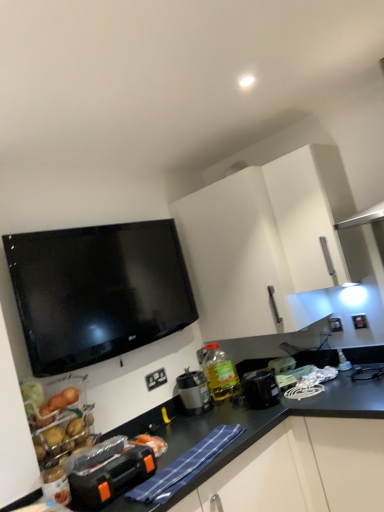
Question: Does white plastic electrical outlet at lower center, the first electric outlet in the left-to-right sequence, have a greater height compared to matte black coffee maker at center, acting as the 3th appliance starting from the right?

Choices:
 (A) no
 (B) yes

Answer: (A)

Question: From the image's perspective, is white plastic electrical outlet at lower center, which is the first electric outlet from bottom to top, located above matte black coffee maker at center, which ranks as the third appliance in front-to-back order?

Choices:
 (A) yes
 (B) no

Answer: (A)

Question: From the image's perspective, is white plastic electrical outlet at lower center, which is counted as the 1th electric outlet, starting from the front, under matte black coffee maker at center, the 2th appliance positioned from the left?

Choices:
 (A) no
 (B) yes

Answer: (A)

Question: Is matte black coffee maker at center, the 2th appliance positioned from the left, inside white plastic electrical outlet at lower center, which is counted as the second electric outlet, starting from the back?

Choices:
 (A) yes
 (B) no

Answer: (B)

Question: From a real-world perspective, does white plastic electrical outlet at lower center, which is the first electric outlet from bottom to top, sit lower than matte black coffee maker at center, which is counted as the second appliance, starting from the back?

Choices:
 (A) yes
 (B) no

Answer: (B)

Question: Would you say black plastic toolbox at lower left, the 4th appliance from the right, is to the left or to the right of white plastic toaster at right, the fourth appliance in the front-to-back sequence, in the picture?

Choices:
 (A) right
 (B) left

Answer: (B)

Question: From their relative heights in the image, would you say black plastic toolbox at lower left, the 1th appliance from the left, is taller or shorter than white plastic toaster at right, the fourth appliance in the front-to-back sequence?

Choices:
 (A) tall
 (B) short

Answer: (A)

Question: Is black plastic toolbox at lower left, the 1th appliance from the left, wider or thinner than white plastic toaster at right, the 1th appliance from the back?

Choices:
 (A) wide
 (B) thin

Answer: (A)

Question: From a real-world perspective, is black plastic toolbox at lower left, the 4th appliance from the right, positioned above or below white plastic toaster at right, the fourth appliance in the front-to-back sequence?

Choices:
 (A) above
 (B) below

Answer: (B)

Question: From a real-world perspective, is white plastic electrical outlet at lower center, the first electric outlet in the left-to-right sequence, physically located above or below white matte cabinet at upper center?

Choices:
 (A) below
 (B) above

Answer: (A)

Question: Considering the positions of white plastic electrical outlet at lower center, the 2th electric outlet viewed from the right, and white matte cabinet at upper center in the image, is white plastic electrical outlet at lower center, the 2th electric outlet viewed from the right, wider or thinner than white matte cabinet at upper center?

Choices:
 (A) wide
 (B) thin

Answer: (B)

Question: Is point (160, 376) positioned closer to the camera than point (274, 201)?

Choices:
 (A) farther
 (B) closer

Answer: (A)

Question: From the image's perspective, is white plastic electrical outlet at lower center, the first electric outlet in the left-to-right sequence, above or below white matte cabinet at upper center?

Choices:
 (A) above
 (B) below

Answer: (B)

Question: From a real-world perspective, relative to translucent yellow bottle at center, is matte black coffee maker at center, acting as the 3th appliance starting from the right, vertically above or below?

Choices:
 (A) below
 (B) above

Answer: (A)

Question: Looking at their shapes, would you say matte black coffee maker at center, the 2th appliance positioned from the left, is wider or thinner than translucent yellow bottle at center?

Choices:
 (A) wide
 (B) thin

Answer: (B)